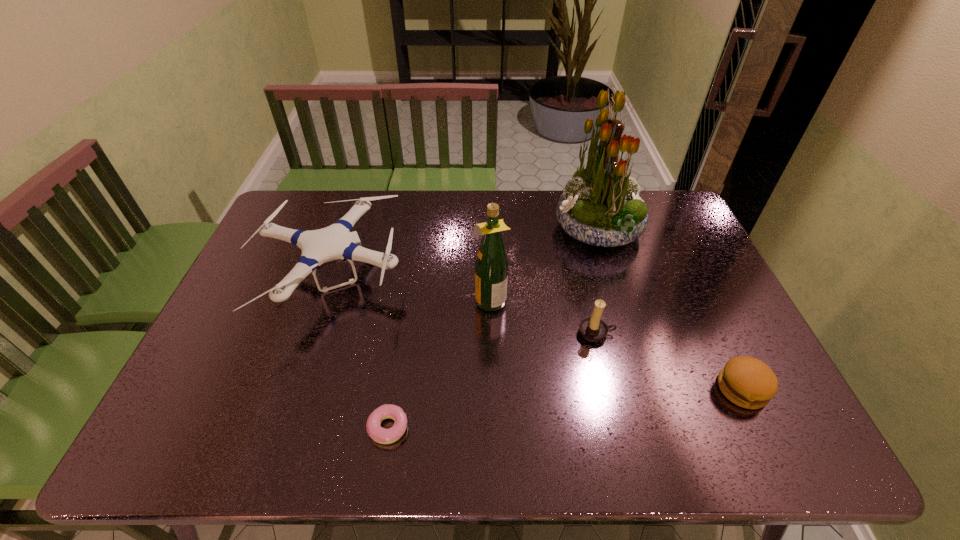
This screenshot has width=960, height=540. Find the location of `free space between the candle holder and the shortest object`. free space between the candle holder and the shortest object is located at coordinates (492, 380).

You are a GUI agent. You are given a task and a screenshot of the screen. Output one action in this format:
    pyautogui.click(x=<x>, y=<y>)
    Task: Click on the vacant area that lies between the doughnut and the second tallest object
    The width and height of the screenshot is (960, 540).
    Given the screenshot: What is the action you would take?
    pyautogui.click(x=439, y=363)

Locate an element on the screen. This screenshot has height=540, width=960. vacant area that lies between the liquor and the flower arrangement is located at coordinates (543, 264).

I want to click on free space between the shortest object and the tallest object, so tap(493, 328).

Where is `vacant area that lies between the tallest object and the hamburger`? Image resolution: width=960 pixels, height=540 pixels. vacant area that lies between the tallest object and the hamburger is located at coordinates (670, 309).

At what (x,y) coordinates should I click in order to perform the action: click on vacant area that lies between the drone and the liquor. Please return your answer as a coordinate pair (x, y). Image resolution: width=960 pixels, height=540 pixels. Looking at the image, I should click on (411, 289).

Identify the location of vacant area between the drone and the tallest object. The width and height of the screenshot is (960, 540). pos(466,255).

You are a GUI agent. You are given a task and a screenshot of the screen. Output one action in this format:
    pyautogui.click(x=<x>, y=<y>)
    Task: Click on the blank region between the flower arrangement and the rightmost object
    The height and width of the screenshot is (540, 960).
    Given the screenshot: What is the action you would take?
    670,309

Locate an element on the screen. This screenshot has width=960, height=540. vacant area between the drone and the tallest object is located at coordinates (466, 255).

Where is `the third closest object to the candle holder`? Image resolution: width=960 pixels, height=540 pixels. the third closest object to the candle holder is located at coordinates (747, 382).